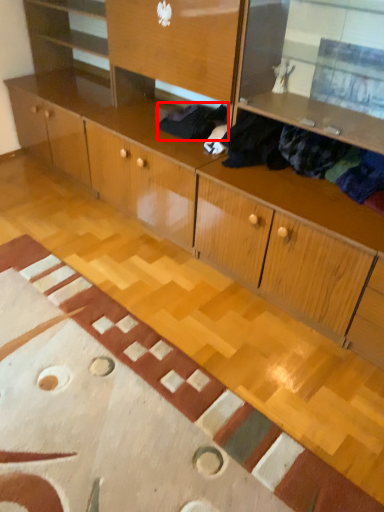
Question: Considering the relative positions of clothing (annotated by the red box) and clothing in the image provided, where is clothing (annotated by the red box) located with respect to the staircase?

Choices:
 (A) left
 (B) right

Answer: (A)